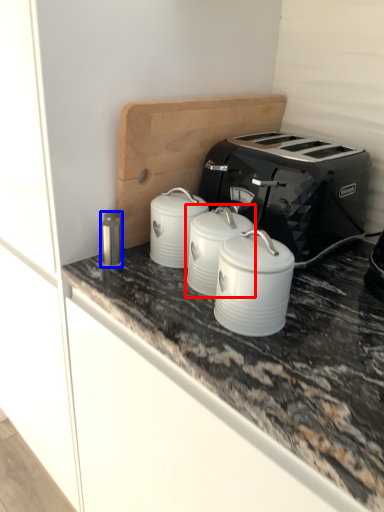
Question: Which object is closer to the camera taking this photo, appliance (highlighted by a red box) or appliance (highlighted by a blue box)?

Choices:
 (A) appliance
 (B) appliance

Answer: (A)